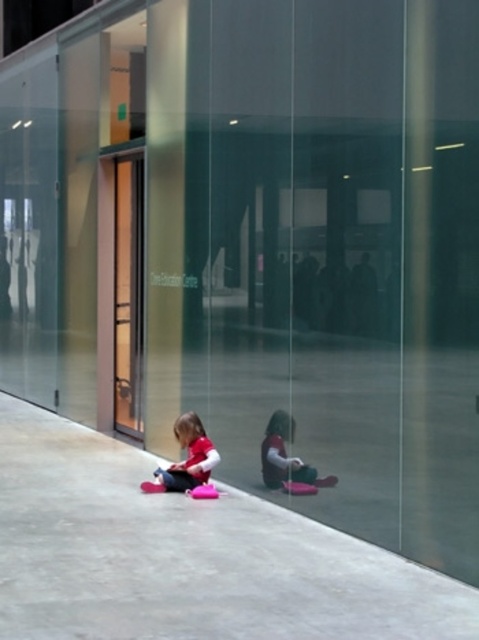
Is matte pink fabric at lower center wider than matte pink toy at lower center?

Yes.

The width and height of the screenshot is (479, 640). What do you see at coordinates (186, 458) in the screenshot? I see `matte pink fabric at lower center` at bounding box center [186, 458].

Describe the element at coordinates (186, 458) in the screenshot. I see `matte pink fabric at lower center` at that location.

This screenshot has width=479, height=640. I want to click on matte pink fabric at lower center, so click(x=186, y=458).

What do you see at coordinates (185, 556) in the screenshot? I see `concrete at lower center` at bounding box center [185, 556].

Does concrete at lower center have a greater width compared to matte pink toy at lower center?

Correct, the width of concrete at lower center exceeds that of matte pink toy at lower center.

Is point (305, 524) farther from camera compared to point (275, 449)?

No, it is not.

This screenshot has width=479, height=640. Find the location of `concrete at lower center`. concrete at lower center is located at coordinates (185, 556).

Between concrete at lower center and matte pink fabric at lower center, which one is positioned higher?

Positioned higher is matte pink fabric at lower center.

Is concrete at lower center to the left of matte pink fabric at lower center from the viewer's perspective?

No, concrete at lower center is not to the left of matte pink fabric at lower center.

You are a GUI agent. You are given a task and a screenshot of the screen. Output one action in this format:
    pyautogui.click(x=<x>, y=<y>)
    Task: Click on the concrete at lower center
    The image size is (479, 640).
    Given the screenshot: What is the action you would take?
    [185, 556]